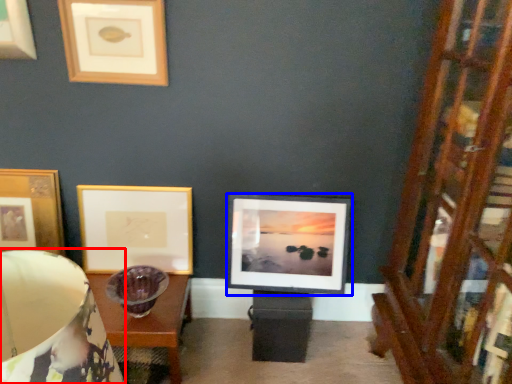
Question: Which object appears closest to the camera in this image, table lamp (highlighted by a red box) or picture frame (highlighted by a blue box)?

Choices:
 (A) table lamp
 (B) picture frame

Answer: (A)